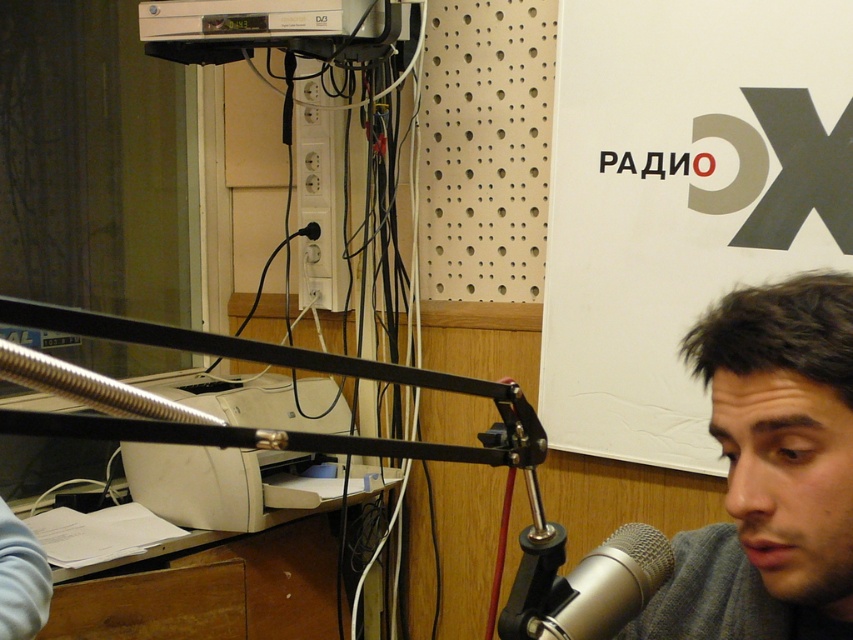
Does white paperboard at upper center have a greater height compared to silver metallic microphone at center?

Indeed, white paperboard at upper center has a greater height compared to silver metallic microphone at center.

Find the location of `white paperboard at upper center`. white paperboard at upper center is located at coordinates (682, 198).

You are a GUI agent. You are given a task and a screenshot of the screen. Output one action in this format:
    pyautogui.click(x=<x>, y=<y>)
    Task: Click on the white paperboard at upper center
    
    Given the screenshot: What is the action you would take?
    pyautogui.click(x=682, y=198)

Is gray fabric at lower right below silver metallic microphone at center?

Actually, gray fabric at lower right is above silver metallic microphone at center.

Who is positioned more to the left, gray fabric at lower right or silver metallic microphone at center?

From the viewer's perspective, silver metallic microphone at center appears more on the left side.

Is point (751, 499) positioned before point (648, 568)?

Yes, it is.

At what (x,y) coordinates should I click in order to perform the action: click on gray fabric at lower right. Please return your answer as a coordinate pair (x, y). The image size is (853, 640). Looking at the image, I should click on (770, 472).

Is the position of white paperboard at upper center less distant than that of gray fabric at lower right?

No, white paperboard at upper center is further to the viewer.

Who is more forward, (772,248) or (733,490)?

Point (733,490)

I want to click on white paperboard at upper center, so click(x=682, y=198).